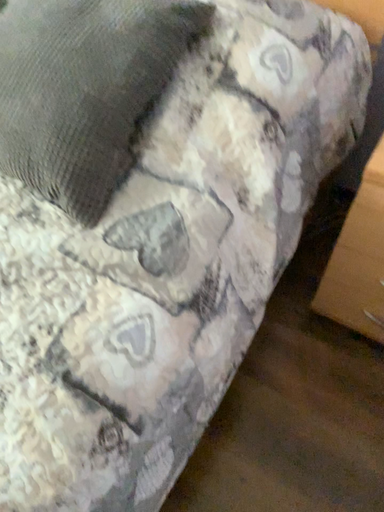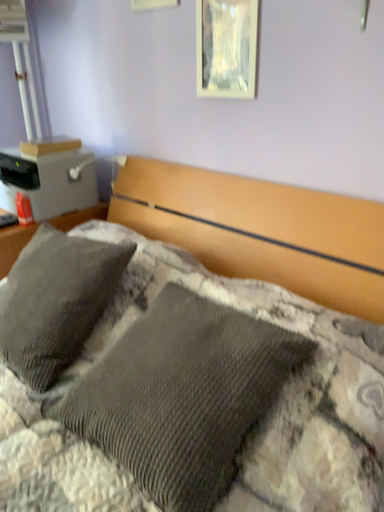
Question: Which way did the camera rotate in the video?

Choices:
 (A) rotated right
 (B) rotated left

Answer: (B)